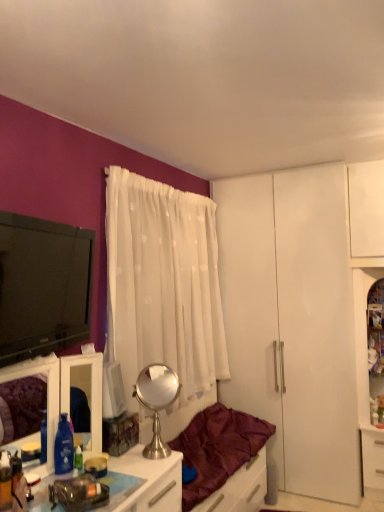
Find the location of a particular element. This screenshot has height=512, width=384. vacant space underneath metallic silver vanity at lower left (from a real-world perspective) is located at coordinates (52, 479).